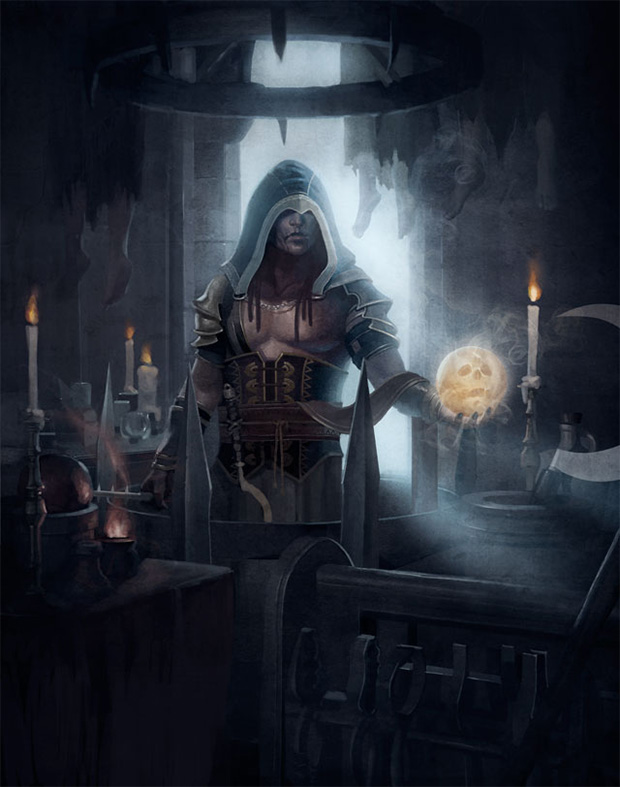
Where is `candle`? Image resolution: width=620 pixels, height=787 pixels. candle is located at coordinates (25, 363), (134, 355), (149, 379), (531, 320).